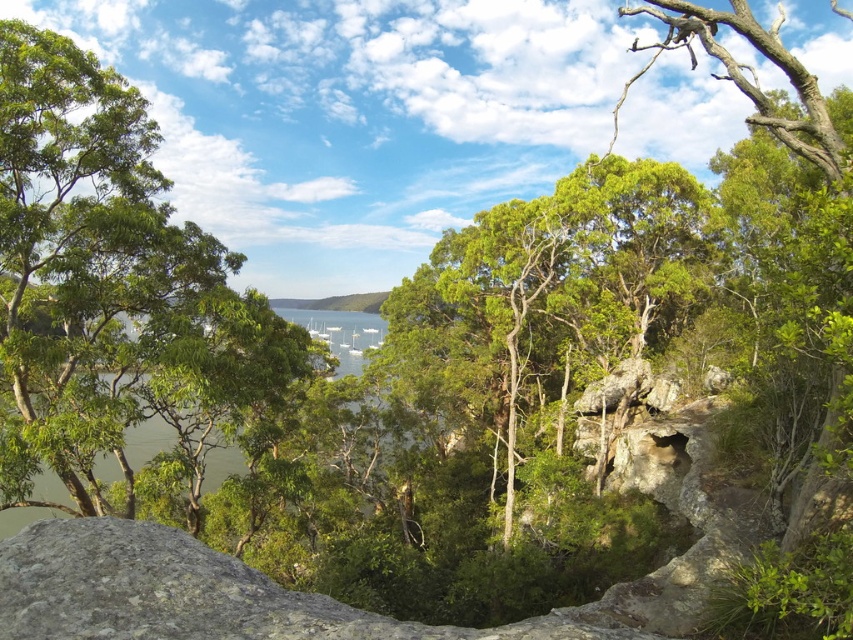
Who is positioned more to the right, green leafy tree at center or green water at center?

green leafy tree at center is more to the right.

Measure the distance from green leafy tree at center to green water at center.

The distance of green leafy tree at center from green water at center is 13.31 meters.

Looking at this image, who is more forward, [688,308] or [132,444]?

Point [132,444] is in front.

In order to click on green leafy tree at center in this screenshot , I will do `click(548, 300)`.

Consider the image. Between green leafy tree at left and green water at center, which one is positioned lower?

green water at center is below.

Which is in front, point (223, 305) or point (61, 486)?

Point (223, 305) is more forward.

This screenshot has height=640, width=853. Describe the element at coordinates (109, 288) in the screenshot. I see `green leafy tree at left` at that location.

Find the location of `green leafy tree at left`. green leafy tree at left is located at coordinates (109, 288).

Between green leafy tree at left and green leafy tree at center, which one is positioned higher?

green leafy tree at left is higher up.

Is green leafy tree at left above green leafy tree at center?

Yes.

Is point (73, 394) positioned in front of point (450, 332)?

Yes, point (73, 394) is in front of point (450, 332).

Where is `green leafy tree at left`? This screenshot has width=853, height=640. green leafy tree at left is located at coordinates (109, 288).